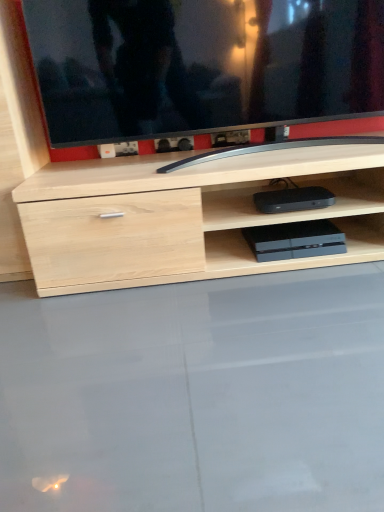
Find the location of `free space above slate gray plastic game console at lower center, which is counted as the first equipment, starting from the bottom (from a real-world perspective)`. free space above slate gray plastic game console at lower center, which is counted as the first equipment, starting from the bottom (from a real-world perspective) is located at coordinates (302, 229).